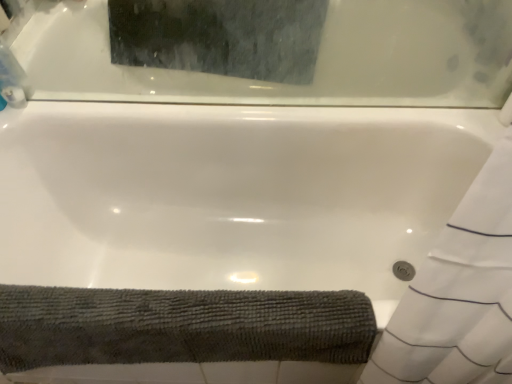
Question: From the image's perspective, does white glossy bathtub at upper center appear lower than dark gray textured bath towel at lower left?

Choices:
 (A) no
 (B) yes

Answer: (A)

Question: Is white glossy bathtub at upper center bigger than dark gray textured bath towel at lower left?

Choices:
 (A) yes
 (B) no

Answer: (B)

Question: Considering the relative sizes of white glossy bathtub at upper center and dark gray textured bath towel at lower left in the image provided, is white glossy bathtub at upper center smaller than dark gray textured bath towel at lower left?

Choices:
 (A) no
 (B) yes

Answer: (B)

Question: From a real-world perspective, is white glossy bathtub at upper center on top of dark gray textured bath towel at lower left?

Choices:
 (A) yes
 (B) no

Answer: (A)

Question: Does white glossy bathtub at upper center turn towards dark gray textured bath towel at lower left?

Choices:
 (A) no
 (B) yes

Answer: (A)

Question: From a real-world perspective, relative to white glossy bathtub at upper center, is dark gray textured bath towel at lower left vertically above or below?

Choices:
 (A) below
 (B) above

Answer: (A)

Question: Would you say dark gray textured bath towel at lower left is to the left or to the right of white glossy bathtub at upper center in the picture?

Choices:
 (A) right
 (B) left

Answer: (B)

Question: Based on their sizes in the image, would you say dark gray textured bath towel at lower left is bigger or smaller than white glossy bathtub at upper center?

Choices:
 (A) big
 (B) small

Answer: (A)

Question: From the image's perspective, is dark gray textured bath towel at lower left above or below white glossy bathtub at upper center?

Choices:
 (A) above
 (B) below

Answer: (B)

Question: Considering the positions of clear plastic bottle at upper left and dark gray textured bath towel at lower left in the image, is clear plastic bottle at upper left taller or shorter than dark gray textured bath towel at lower left?

Choices:
 (A) tall
 (B) short

Answer: (B)

Question: Considering their positions, is clear plastic bottle at upper left located in front of or behind dark gray textured bath towel at lower left?

Choices:
 (A) behind
 (B) front

Answer: (A)

Question: Would you say clear plastic bottle at upper left is to the left or to the right of dark gray textured bath towel at lower left in the picture?

Choices:
 (A) left
 (B) right

Answer: (A)

Question: Looking at the image, does clear plastic bottle at upper left seem bigger or smaller compared to dark gray textured bath towel at lower left?

Choices:
 (A) small
 (B) big

Answer: (A)

Question: Considering the positions of white glossy bathtub at upper center and clear plastic bottle at upper left in the image, is white glossy bathtub at upper center bigger or smaller than clear plastic bottle at upper left?

Choices:
 (A) big
 (B) small

Answer: (A)

Question: In the image, is white glossy bathtub at upper center on the left side or the right side of clear plastic bottle at upper left?

Choices:
 (A) left
 (B) right

Answer: (B)